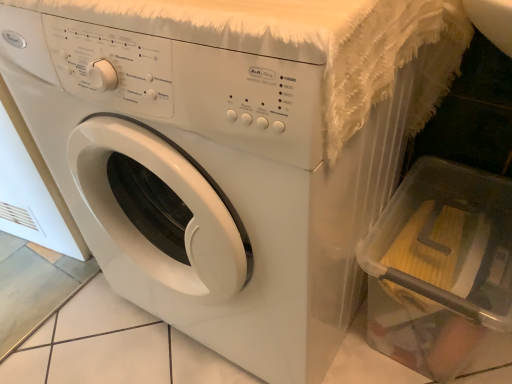
Locate an element on the screen. The width and height of the screenshot is (512, 384). empty space that is ontop of transparent plastic dish washer at lower right is located at coordinates (457, 238).